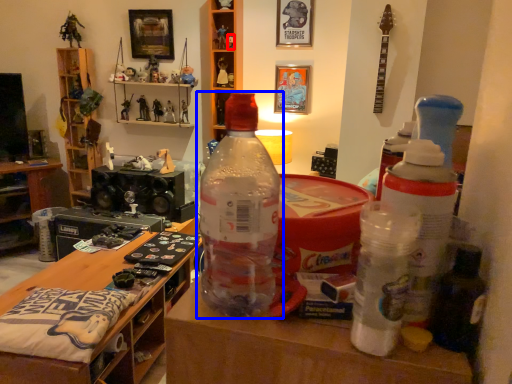
Question: Which point is further to the camera, toy (highlighted by a red box) or bottle (highlighted by a blue box)?

Choices:
 (A) toy
 (B) bottle

Answer: (A)